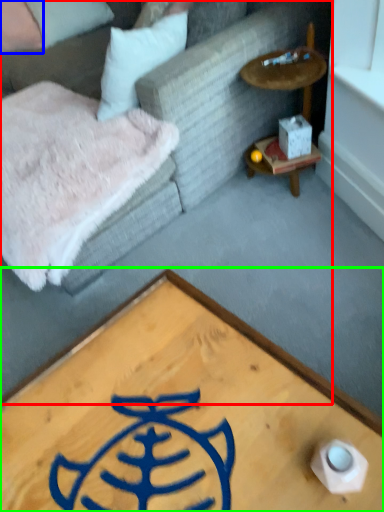
Question: Which is nearer to the studio couch (highlighted by a red box)? pillow (highlighted by a blue box) or coffee table (highlighted by a green box).

Choices:
 (A) pillow
 (B) coffee table

Answer: (B)